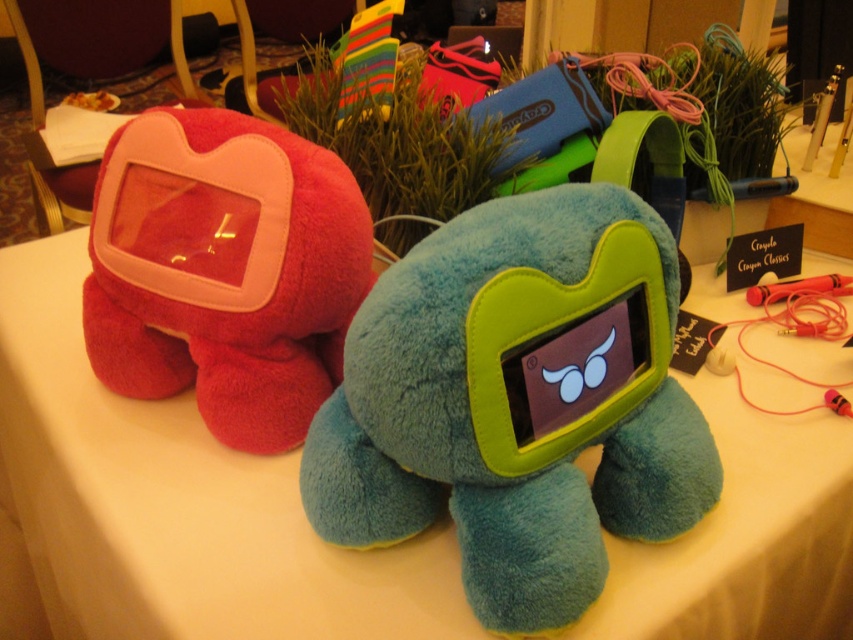
You are arranging a display of plush toys and need to place the teal plush toy at center and the matte pink plush at left. According to the image, which plush toy is located to the right of the other?

The teal plush toy at center is positioned on the right side of the matte pink plush at left, so the teal plush toy at center is to the right of the matte pink plush at left.

Consider the image. You are setting up a display table and need to place the white cloth at center and the teal plush toy at center. Which object should you place first to ensure proper positioning?

The white cloth at center should be placed first because it is bigger than the teal plush toy at center, allowing for easier adjustment of the toy afterward.